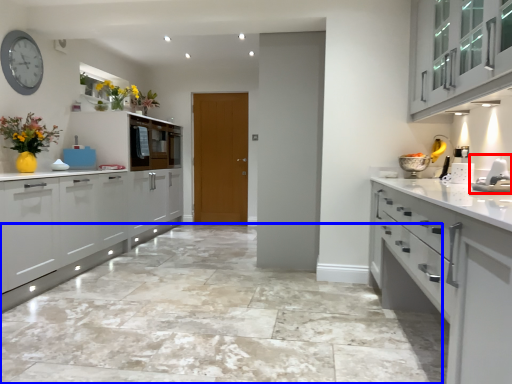
Question: Which object is closer to the camera taking this photo, sink (highlighted by a red box) or granite (highlighted by a blue box)?

Choices:
 (A) sink
 (B) granite

Answer: (B)